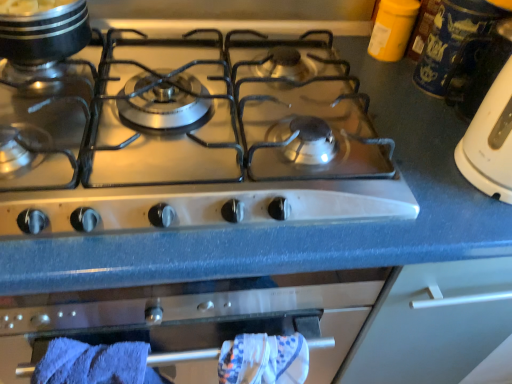
You are a GUI agent. You are given a task and a screenshot of the screen. Output one action in this format:
    pyautogui.click(x=<x>, y=<y>)
    Task: Click on the vacant area that is in front of blue ceramic mug at upper right
    Image resolution: width=512 pixels, height=384 pixels.
    Given the screenshot: What is the action you would take?
    pyautogui.click(x=409, y=139)